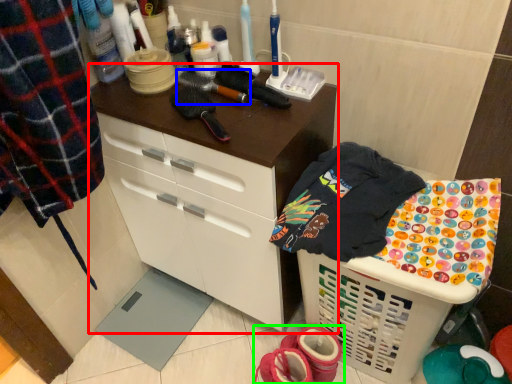
Question: Which object is the farthest from cabinetry (highlighted by a red box)? Choose among these: brush (highlighted by a blue box) or footwear (highlighted by a green box).

Choices:
 (A) brush
 (B) footwear

Answer: (B)